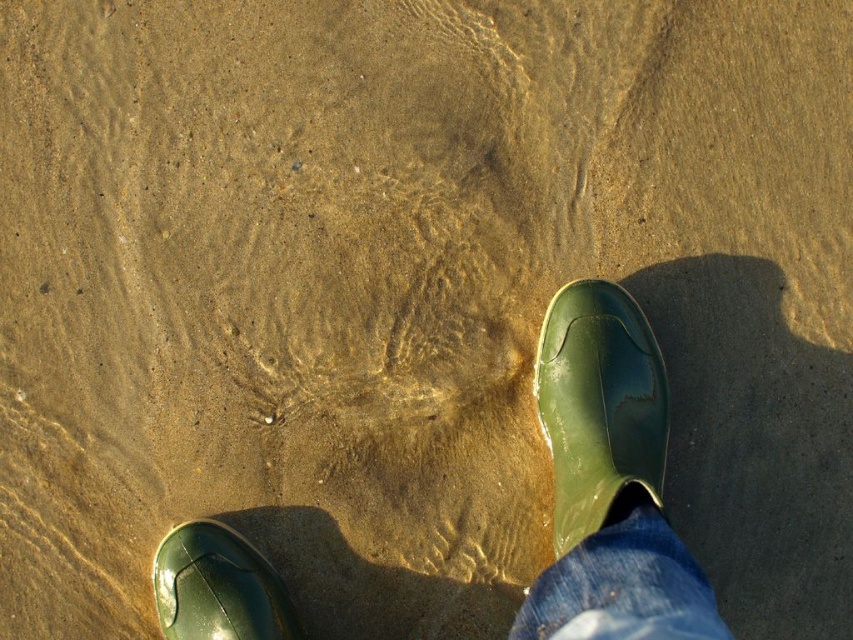
Question: Estimate the real-world distances between objects in this image. Which object is farther from the green rubber boot at right?

Choices:
 (A) denim at lower right
 (B) green rubber boots at center

Answer: (A)

Question: Does green rubber boot at right come in front of green rubber boot at lower left?

Choices:
 (A) no
 (B) yes

Answer: (B)

Question: From the image, what is the correct spatial relationship of green rubber boots at center in relation to green rubber boot at right?

Choices:
 (A) left
 (B) right

Answer: (A)

Question: Among these points, which one is nearest to the camera?

Choices:
 (A) (560, 611)
 (B) (207, 628)

Answer: (A)

Question: Estimate the real-world distances between objects in this image. Which object is closer to the green rubber boot at lower left?

Choices:
 (A) green rubber boot at right
 (B) denim at lower right
 (C) green rubber boots at center

Answer: (C)

Question: From the image, what is the correct spatial relationship of green rubber boot at right in relation to denim at lower right?

Choices:
 (A) left
 (B) right

Answer: (B)